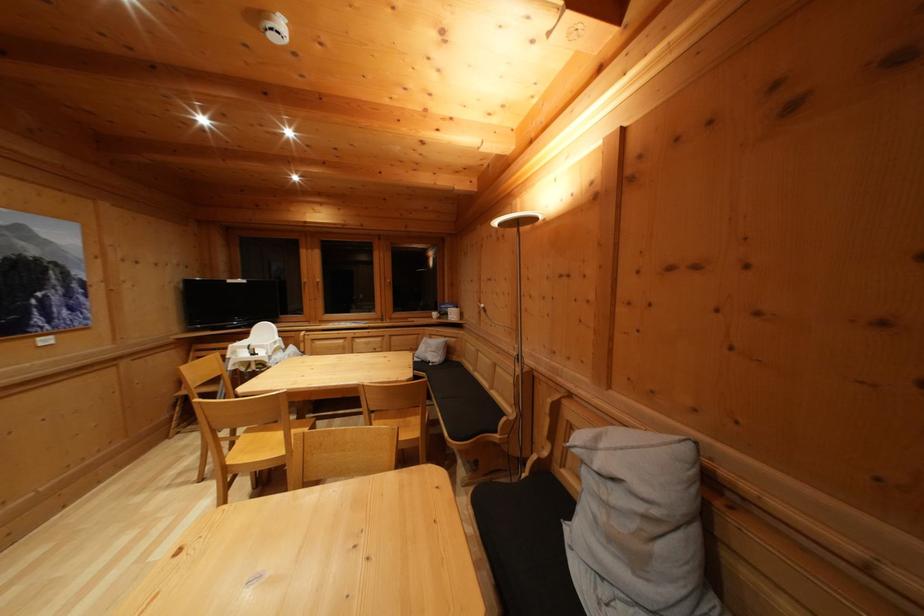
Where would you sit the bench sitting surface? Please return your answer as a coordinate pair (x, y).

(463, 403)